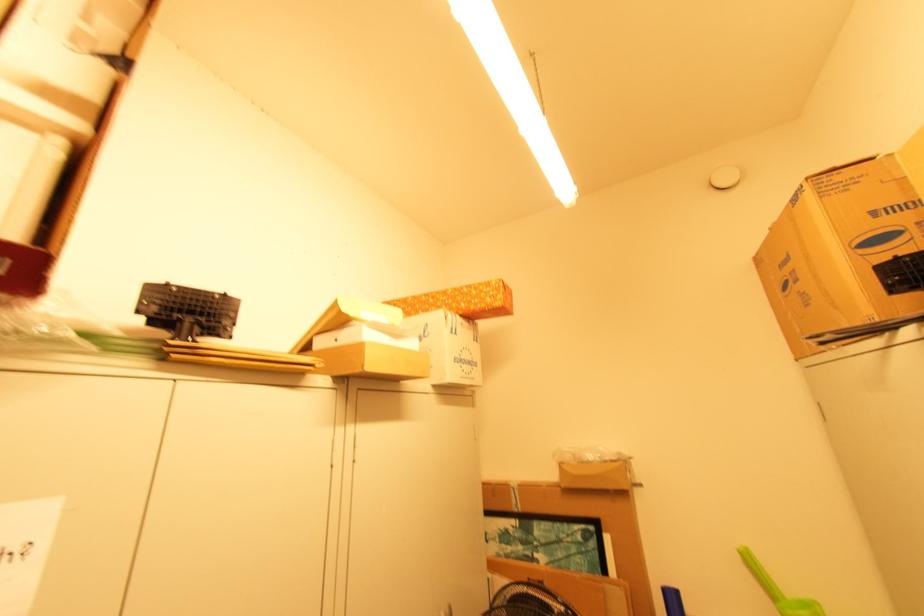
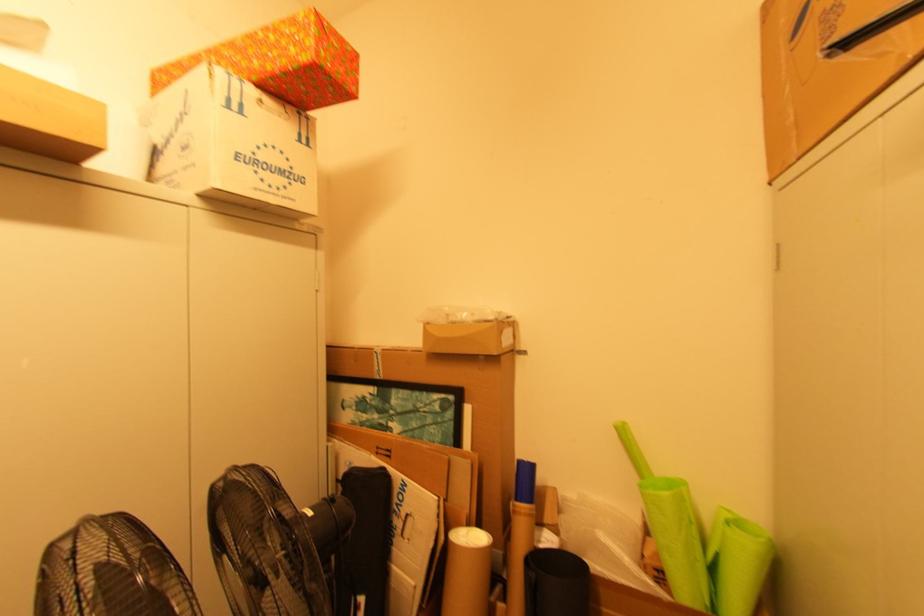
Locate, in the second image, the point that corresponds to (x=463, y=355) in the first image.

(257, 154)